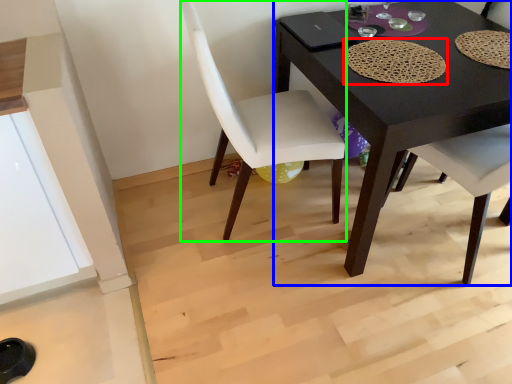
Question: Based on their relative distances, which object is nearer to mat (highlighted by a red box)? Choose from desk (highlighted by a blue box) and chair (highlighted by a green box).

Choices:
 (A) desk
 (B) chair

Answer: (A)